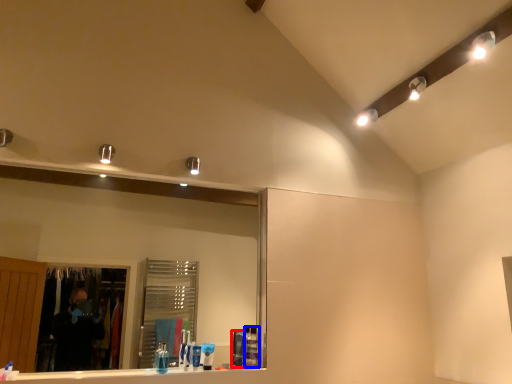
Question: Which object is further to the camera taking this photo, toiletry (highlighted by a red box) or toiletry (highlighted by a blue box)?

Choices:
 (A) toiletry
 (B) toiletry

Answer: (B)